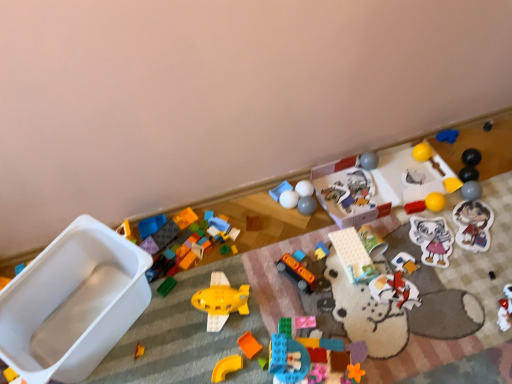
The height and width of the screenshot is (384, 512). What are the coordinates of `vacant space in between white matte figure at center, placed as the seventh toy when sorted from right to left, and matte plastic stickers at lower right, which is counted as the third toy, starting from the right` in the screenshot? It's located at (434, 253).